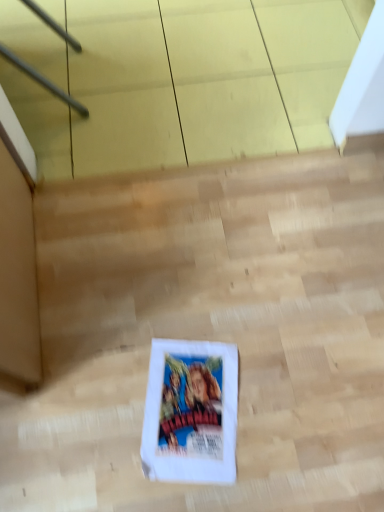
At what (x,y) coordinates should I click in order to perform the action: click on free space above white paper bag at center (from a real-world perspective). Please return your answer as a coordinate pair (x, y). The image size is (384, 512). Looking at the image, I should click on (223, 320).